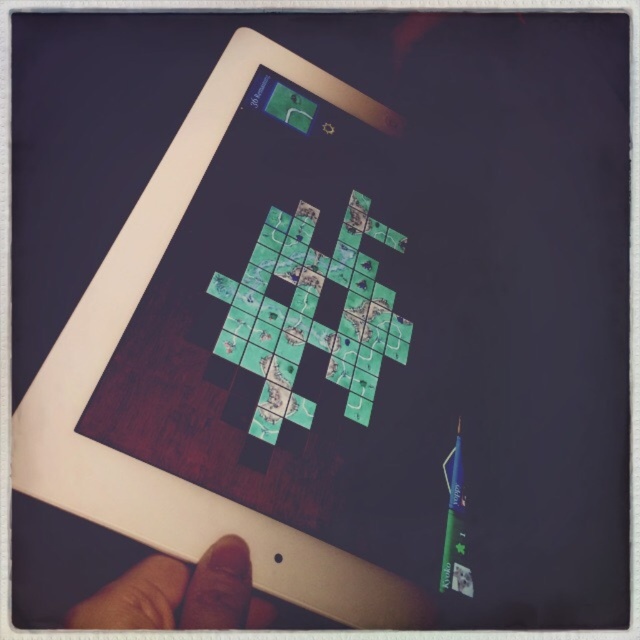
Consider the image. You are holding a tablet with a screen that is 10 inches wide. You want to place your finger on the brown skin at lower left and the green matte puzzle pieces at center simultaneously. Is this possible?

The distance between the green matte puzzle pieces at center and the brown skin at lower left is 14.60 inches. Since the tablet screen is only 10 inches wide, your fingers cannot reach both areas at the same time.

You are playing a puzzle game on a tablet. You see the green matte puzzle pieces at center and the brown skin at lower left. Which object is positioned higher on the screen?

The green matte puzzle pieces at center are positioned higher on the screen than the brown skin at lower left.

You are trying to solve a puzzle on a tablet. The puzzle has green matte puzzle pieces at center and brown skin at lower left. Which object is wider?

The green matte puzzle pieces at center are wider than the brown skin at lower left.